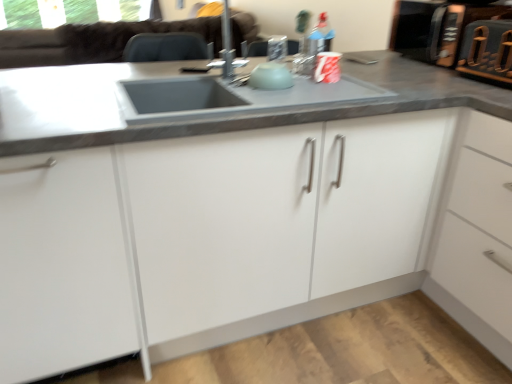
Question: Relative to metallic silver toaster at upper right, is white matte cabinet at center in front or behind?

Choices:
 (A) front
 (B) behind

Answer: (A)

Question: Is white matte cabinet at center to the left or to the right of metallic silver toaster at upper right in the image?

Choices:
 (A) left
 (B) right

Answer: (A)

Question: From their relative heights in the image, would you say white matte cabinet at center is taller or shorter than metallic silver toaster at upper right?

Choices:
 (A) short
 (B) tall

Answer: (B)

Question: Is metallic silver toaster at upper right to the left or to the right of white matte cabinet at center in the image?

Choices:
 (A) right
 (B) left

Answer: (A)

Question: In the image, is metallic silver toaster at upper right positioned in front of or behind white matte cabinet at center?

Choices:
 (A) front
 (B) behind

Answer: (B)

Question: Is point (436, 41) positioned closer to the camera than point (78, 185)?

Choices:
 (A) closer
 (B) farther

Answer: (B)

Question: Looking at the image, does metallic silver toaster at upper right seem bigger or smaller compared to white matte cabinet at center?

Choices:
 (A) small
 (B) big

Answer: (A)